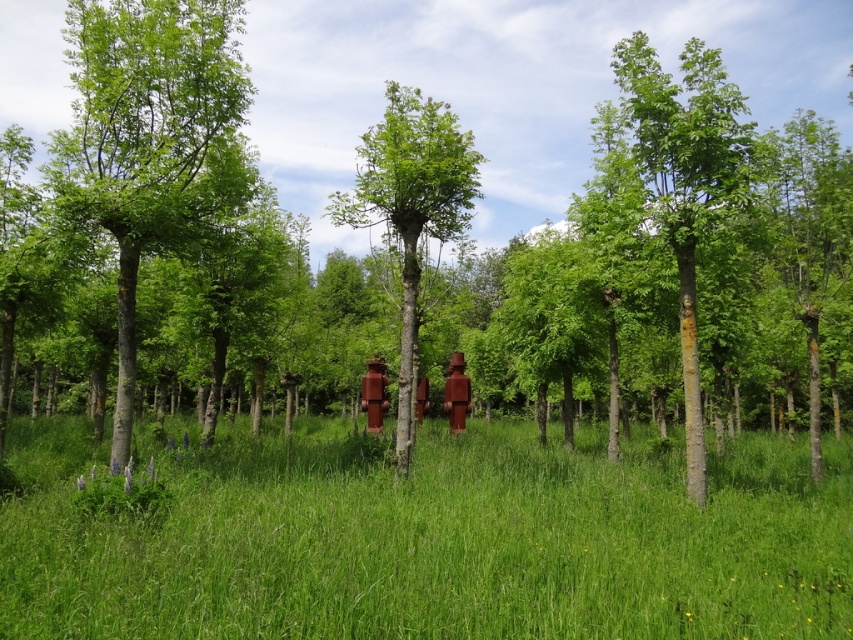
Question: Is green smooth tree at left to the left of green matte tree at center from the viewer's perspective?

Choices:
 (A) no
 (B) yes

Answer: (B)

Question: Estimate the real-world distances between objects in this image. Which object is closer to the green smooth bark tree at center?

Choices:
 (A) green grassy at center
 (B) green smooth tree at left

Answer: (A)

Question: Observing the image, what is the correct spatial positioning of green smooth bark tree at center in reference to green matte tree at center?

Choices:
 (A) below
 (B) above

Answer: (A)

Question: Considering the real-world distances, which object is farthest from the green smooth tree at left?

Choices:
 (A) green matte tree at center
 (B) green smooth bark tree at center
 (C) green grassy at center

Answer: (B)

Question: Which point is farther to the camera?

Choices:
 (A) green smooth tree at left
 (B) green grassy at center
 (C) green smooth bark tree at center

Answer: (C)

Question: Can you confirm if green smooth bark tree at center is positioned to the left of green matte tree at center?

Choices:
 (A) yes
 (B) no

Answer: (B)